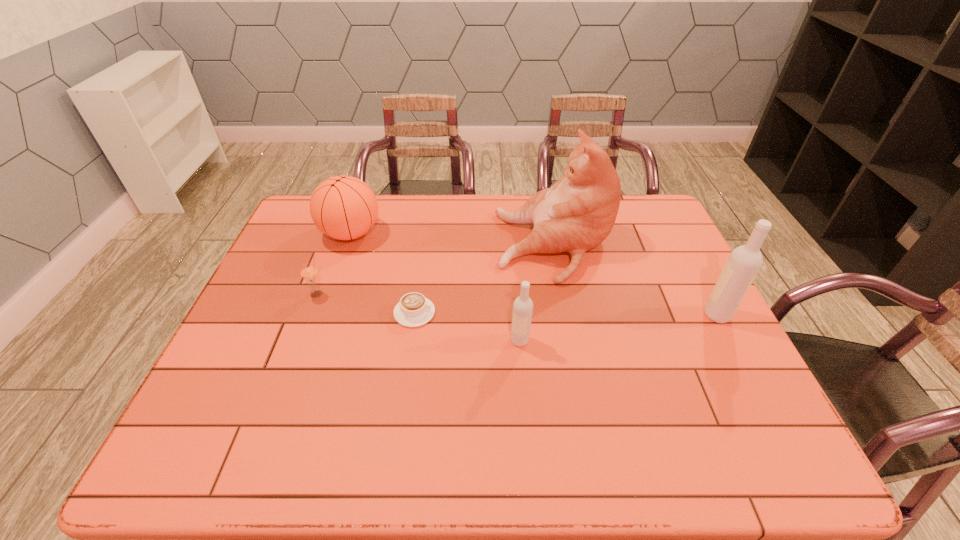
Identify the location of the nearer vodka. (523, 306).

I want to click on the left vodka, so 523,306.

At what (x,y) coordinates should I click in order to perform the action: click on the right vodka. Please return your answer as a coordinate pair (x, y). The width and height of the screenshot is (960, 540). Looking at the image, I should click on (744, 262).

Locate an element on the screen. the taller vodka is located at coordinates (744, 262).

Where is `basketball`? This screenshot has width=960, height=540. basketball is located at coordinates (343, 207).

Image resolution: width=960 pixels, height=540 pixels. I want to click on cat, so click(577, 213).

You are a GUI agent. You are given a task and a screenshot of the screen. Output one action in this format:
    pyautogui.click(x=<x>, y=<y>)
    Task: Click on the third object from left to right
    This screenshot has height=540, width=960.
    Given the screenshot: What is the action you would take?
    pyautogui.click(x=414, y=310)

You are a GUI agent. You are given a task and a screenshot of the screen. Output one action in this format:
    pyautogui.click(x=<x>, y=<y>)
    Task: Click on the cappuccino
    The width and height of the screenshot is (960, 540).
    Given the screenshot: What is the action you would take?
    pyautogui.click(x=414, y=310)

Where is `straw`? straw is located at coordinates (309, 273).

Locate an element on the screen. free space located 0.300m on the back of the shorter vodka is located at coordinates (513, 257).